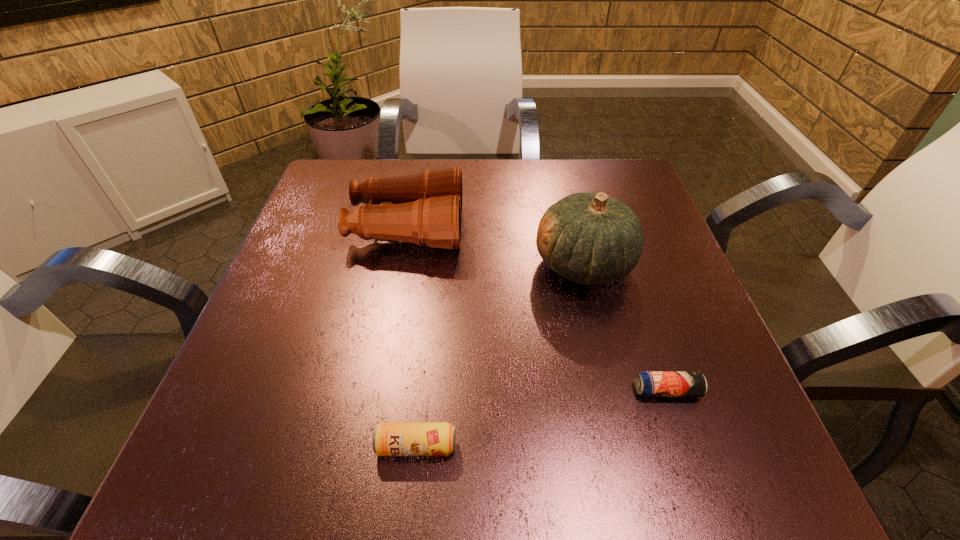
The width and height of the screenshot is (960, 540). Identify the location of free region at the far left corner. (323, 200).

The image size is (960, 540). What are the coordinates of `free space at the far right corner of the desktop` in the screenshot? It's located at (600, 188).

I want to click on free region at the near right corner, so click(654, 447).

The width and height of the screenshot is (960, 540). Find the location of `free spot between the second nearest object and the third shortest object`. free spot between the second nearest object and the third shortest object is located at coordinates (537, 310).

This screenshot has height=540, width=960. Find the location of `free space between the left beer can and the gourd`. free space between the left beer can and the gourd is located at coordinates (500, 355).

At what (x,y) coordinates should I click in order to perform the action: click on unoccupied area between the farther beer can and the nearer beer can. Please return your answer as a coordinate pair (x, y). Looking at the image, I should click on (541, 418).

Identify the location of unoccupied position between the second nearest object and the nearer beer can. (541, 418).

Image resolution: width=960 pixels, height=540 pixels. What are the coordinates of `empty location between the nearest object and the second tallest object` in the screenshot? It's located at (412, 337).

Find the location of a particular element. This screenshot has height=540, width=960. empty space that is in between the farther beer can and the left beer can is located at coordinates pos(541,418).

Where is `free space between the binoculars and the gourd`? Image resolution: width=960 pixels, height=540 pixels. free space between the binoculars and the gourd is located at coordinates 495,246.